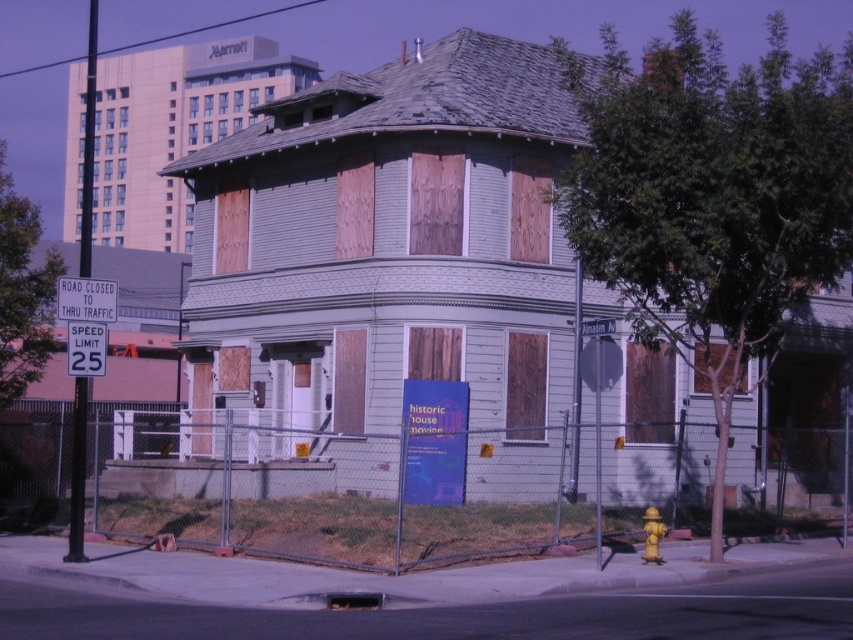
Question: Observing the image, what is the correct spatial positioning of metal speed limit sign at left in reference to yellow metallic hydrant at lower right?

Choices:
 (A) below
 (B) above

Answer: (B)

Question: In this image, where is white plastic road sign at upper left located relative to yellow metallic hydrant at lower right?

Choices:
 (A) below
 (B) above

Answer: (B)

Question: Which of the following is the farthest from the observer?

Choices:
 (A) metallic chain-link fence at center
 (B) metal speed limit sign at left

Answer: (B)

Question: Which point appears closest to the camera in this image?

Choices:
 (A) (234, 428)
 (B) (90, 305)

Answer: (B)

Question: Which point is farther to the camera?

Choices:
 (A) yellow metallic hydrant at lower right
 (B) metallic chain-link fence at center

Answer: (A)

Question: Does metal speed limit sign at left come behind yellow metallic hydrant at lower right?

Choices:
 (A) yes
 (B) no

Answer: (A)